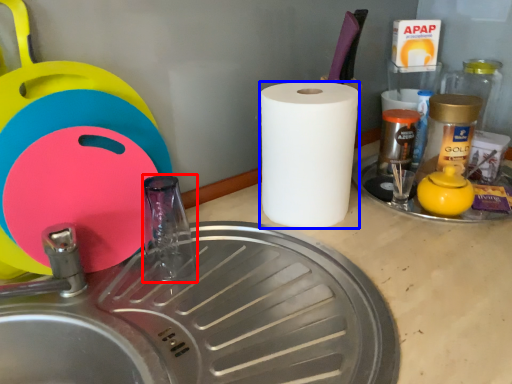
Question: Which object appears closest to the camera in this image, faucet (highlighted by a red box) or paper towel (highlighted by a blue box)?

Choices:
 (A) faucet
 (B) paper towel

Answer: (A)